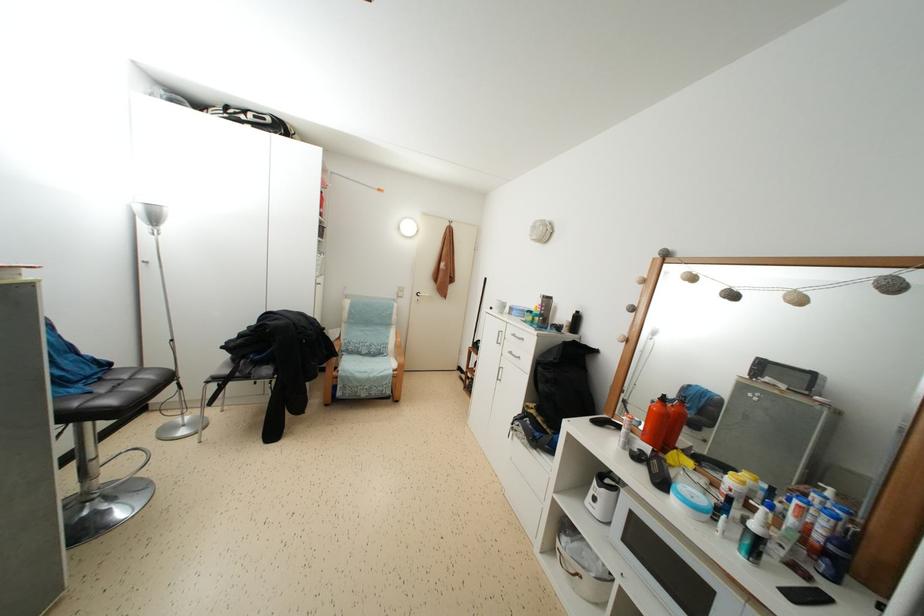
What do you see at coordinates (397, 355) in the screenshot? This screenshot has height=616, width=924. I see `a wooden chair armrest` at bounding box center [397, 355].